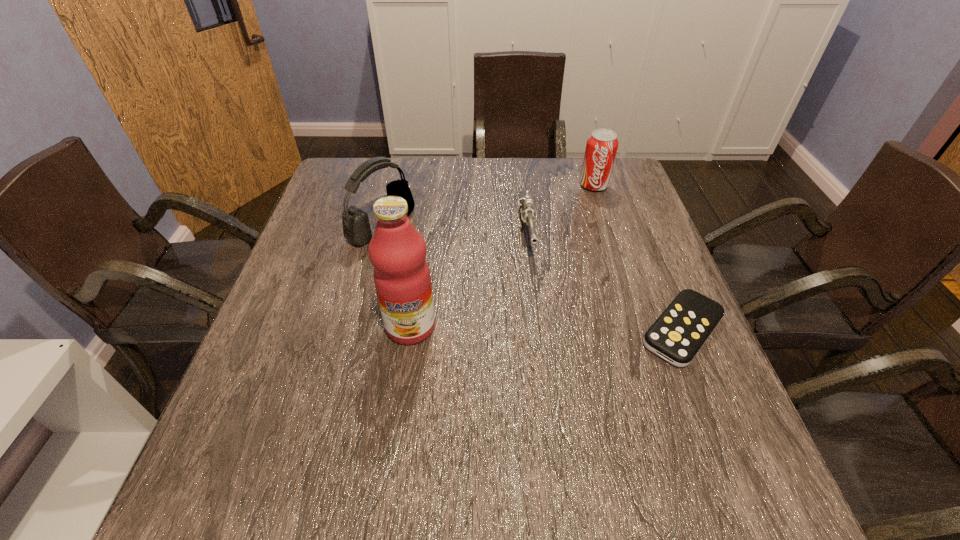
Where is `free spot located 0.320m on the logo side of the farthest object`? This screenshot has width=960, height=540. free spot located 0.320m on the logo side of the farthest object is located at coordinates (585, 266).

Where is `vacant region located on the logo side of the farthest object`? The height and width of the screenshot is (540, 960). vacant region located on the logo side of the farthest object is located at coordinates (583, 280).

Locate an element on the screen. The image size is (960, 540). blank area located 0.360m on the headband of the second tallest object is located at coordinates (517, 303).

Image resolution: width=960 pixels, height=540 pixels. Identify the location of free space located on the headband of the second tallest object. (453, 268).

Where is `vacant space located on the headband of the second tallest object`? The width and height of the screenshot is (960, 540). vacant space located on the headband of the second tallest object is located at coordinates (479, 282).

Identify the location of free space located 0.130m aimed along the barrel of the third object from right to left. Image resolution: width=960 pixels, height=540 pixels. (538, 301).

Locate an element on the screen. vacant region located aimed along the barrel of the third object from right to left is located at coordinates (549, 368).

What are the coordinates of `vacant region located 0.360m aimed along the barrel of the third object from right to left` in the screenshot? It's located at (553, 390).

The height and width of the screenshot is (540, 960). Find the location of `object that is positioned at the far edge`. object that is positioned at the far edge is located at coordinates (601, 148).

Locate an element on the screen. object present at the left edge is located at coordinates (356, 227).